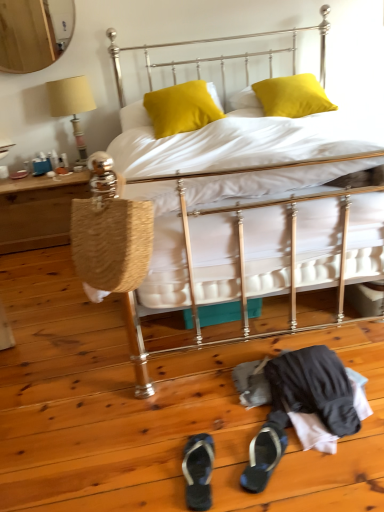
Question: Are blue fabric flip-flop at lower center, which ranks as the first footwear in left-to-right order, and satin yellow pillow at upper center, marked as the first pillow in a right-to-left arrangement, beside each other?

Choices:
 (A) yes
 (B) no

Answer: (B)

Question: Considering the relative sizes of blue fabric flip-flop at lower center, which is counted as the 2th footwear, starting from the right, and satin yellow pillow at upper center, marked as the first pillow in a right-to-left arrangement, in the image provided, is blue fabric flip-flop at lower center, which is counted as the 2th footwear, starting from the right, shorter than satin yellow pillow at upper center, marked as the first pillow in a right-to-left arrangement,?

Choices:
 (A) no
 (B) yes

Answer: (B)

Question: Is the position of blue fabric flip-flop at lower center, which ranks as the first footwear in left-to-right order, more distant than that of satin yellow pillow at upper center, marked as the first pillow in a right-to-left arrangement?

Choices:
 (A) no
 (B) yes

Answer: (A)

Question: Are blue fabric flip-flop at lower center, which ranks as the first footwear in left-to-right order, and satin yellow pillow at upper center, marked as the first pillow in a right-to-left arrangement, far apart?

Choices:
 (A) yes
 (B) no

Answer: (A)

Question: From the image's perspective, is blue fabric flip-flop at lower center, which is counted as the 2th footwear, starting from the right, above satin yellow pillow at upper center, marked as the first pillow in a right-to-left arrangement?

Choices:
 (A) no
 (B) yes

Answer: (A)

Question: Is the position of blue fabric flip-flop at lower center, which is counted as the 2th footwear, starting from the right, less distant than that of satin yellow pillow at upper center, which appears as the 2th pillow when viewed from the left?

Choices:
 (A) no
 (B) yes

Answer: (B)

Question: Is satin yellow pillow at center, positioned as the first pillow in left-to-right order, positioned in front of dark gray fabric sandal at lower center, positioned as the first footwear in right-to-left order?

Choices:
 (A) no
 (B) yes

Answer: (A)

Question: Does satin yellow pillow at center, positioned as the first pillow in left-to-right order, come behind dark gray fabric sandal at lower center, the 2th footwear positioned from the left?

Choices:
 (A) no
 (B) yes

Answer: (B)

Question: Can you confirm if satin yellow pillow at center, positioned as the first pillow in left-to-right order, is smaller than dark gray fabric sandal at lower center, the 2th footwear positioned from the left?

Choices:
 (A) yes
 (B) no

Answer: (B)

Question: Is satin yellow pillow at center, positioned as the first pillow in left-to-right order, to the right of dark gray fabric sandal at lower center, the 2th footwear positioned from the left, from the viewer's perspective?

Choices:
 (A) no
 (B) yes

Answer: (A)

Question: From a real-world perspective, is satin yellow pillow at center, positioned as the first pillow in left-to-right order, over dark gray fabric sandal at lower center, the 2th footwear positioned from the left?

Choices:
 (A) yes
 (B) no

Answer: (A)

Question: Considering the relative positions of satin yellow pillow at center, positioned as the first pillow in left-to-right order, and dark gray fabric sandal at lower center, the 2th footwear positioned from the left, in the image provided, is satin yellow pillow at center, positioned as the first pillow in left-to-right order, to the left of dark gray fabric sandal at lower center, the 2th footwear positioned from the left, from the viewer's perspective?

Choices:
 (A) yes
 (B) no

Answer: (A)

Question: Does woven wood table at left appear on the left side of matte yellow fabric lampshade at left?

Choices:
 (A) no
 (B) yes

Answer: (B)